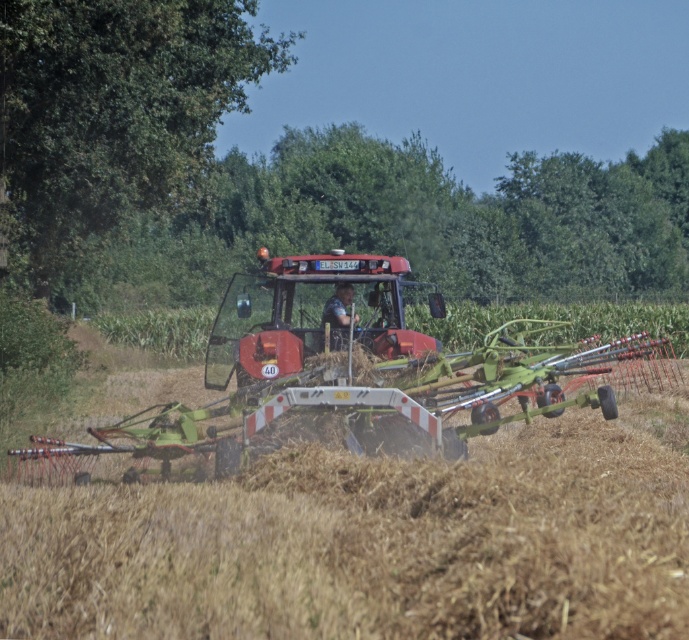
Question: Can you confirm if brown grassy field at center is positioned to the left of matte red tractor at center?

Choices:
 (A) yes
 (B) no

Answer: (A)

Question: Which of the following is the farthest from the observer?

Choices:
 (A) brown grassy field at center
 (B) matte red tractor at center

Answer: (B)

Question: Which object appears closest to the camera in this image?

Choices:
 (A) brown grassy field at center
 (B) matte red tractor at center

Answer: (A)

Question: Does brown grassy field at center have a greater width compared to matte red tractor at center?

Choices:
 (A) no
 (B) yes

Answer: (B)

Question: From the image, what is the correct spatial relationship of brown grassy field at center in relation to matte red tractor at center?

Choices:
 (A) above
 (B) below

Answer: (B)